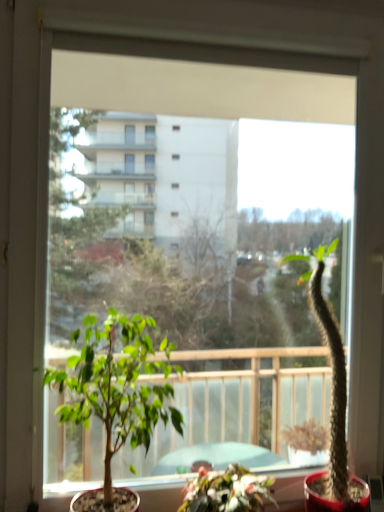
Question: From the image's perspective, is green matte plant at center, the second houseplant in the right-to-left sequence, below green succulent at right, the 3th houseplant positioned from the left?

Choices:
 (A) no
 (B) yes

Answer: (B)

Question: Is green matte plant at center, which appears as the second houseplant when viewed from the left, oriented away from green succulent at right, the first houseplant when ordered from right to left?

Choices:
 (A) no
 (B) yes

Answer: (A)

Question: Is green matte plant at center, which appears as the second houseplant when viewed from the left, aimed at green succulent at right, the first houseplant when ordered from right to left?

Choices:
 (A) yes
 (B) no

Answer: (B)

Question: Is green matte plant at center, which appears as the second houseplant when viewed from the left, thinner than green succulent at right, the first houseplant when ordered from right to left?

Choices:
 (A) no
 (B) yes

Answer: (A)

Question: Can you confirm if green matte plant at center, which appears as the second houseplant when viewed from the left, is taller than green succulent at right, the 3th houseplant positioned from the left?

Choices:
 (A) yes
 (B) no

Answer: (B)

Question: Considering the relative sizes of green matte plant at center, the second houseplant in the right-to-left sequence, and green succulent at right, the 3th houseplant positioned from the left, in the image provided, is green matte plant at center, the second houseplant in the right-to-left sequence, shorter than green succulent at right, the 3th houseplant positioned from the left,?

Choices:
 (A) no
 (B) yes

Answer: (B)

Question: From the image's perspective, would you say green succulent at right, the 3th houseplant positioned from the left, is positioned over green matte plant at center, which appears as the second houseplant when viewed from the left?

Choices:
 (A) yes
 (B) no

Answer: (A)

Question: Is green succulent at right, the first houseplant when ordered from right to left, smaller than green matte plant at center, the second houseplant in the right-to-left sequence?

Choices:
 (A) yes
 (B) no

Answer: (B)

Question: Is green matte plant at center, which appears as the second houseplant when viewed from the left, at the back of green succulent at right, the 3th houseplant positioned from the left?

Choices:
 (A) no
 (B) yes

Answer: (A)

Question: Is green succulent at right, the first houseplant when ordered from right to left, located outside green matte plant at center, the second houseplant in the right-to-left sequence?

Choices:
 (A) yes
 (B) no

Answer: (A)

Question: Can you confirm if green succulent at right, the 3th houseplant positioned from the left, is taller than green matte plant at center, which appears as the second houseplant when viewed from the left?

Choices:
 (A) no
 (B) yes

Answer: (B)

Question: Considering the relative positions of green succulent at right, the first houseplant when ordered from right to left, and green matte plant at center, the second houseplant in the right-to-left sequence, in the image provided, is green succulent at right, the first houseplant when ordered from right to left, to the left of green matte plant at center, the second houseplant in the right-to-left sequence, from the viewer's perspective?

Choices:
 (A) yes
 (B) no

Answer: (B)

Question: Is green succulent at right, the first houseplant when ordered from right to left, located outside green leafy plant at center, which appears as the 3th houseplant when viewed from the right?

Choices:
 (A) yes
 (B) no

Answer: (A)